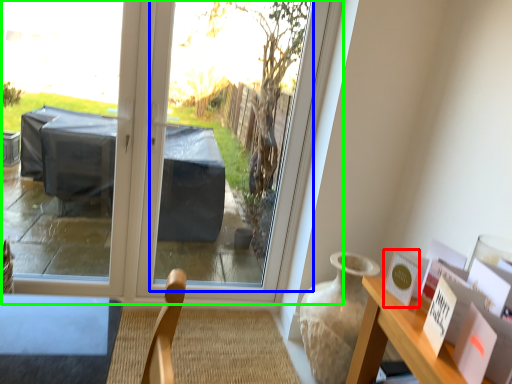
Question: Which is farther away from postcard (highlighted by a red box)? window screen (highlighted by a blue box) or window (highlighted by a green box)?

Choices:
 (A) window screen
 (B) window

Answer: (A)